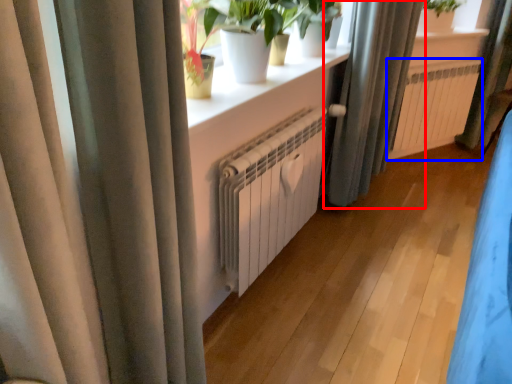
Question: Which of the following is the farthest to the observer, curtain (highlighted by a red box) or radiator (highlighted by a blue box)?

Choices:
 (A) curtain
 (B) radiator

Answer: (B)